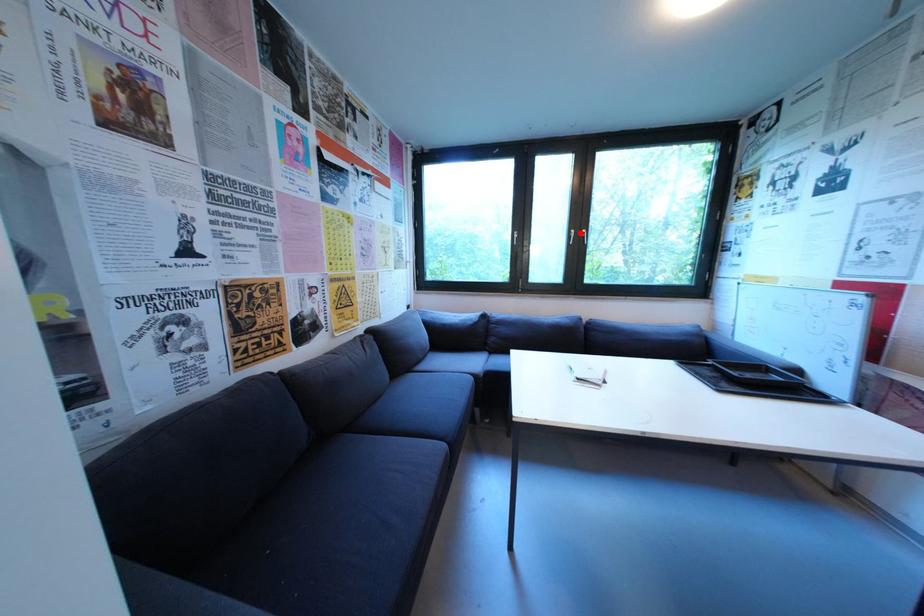
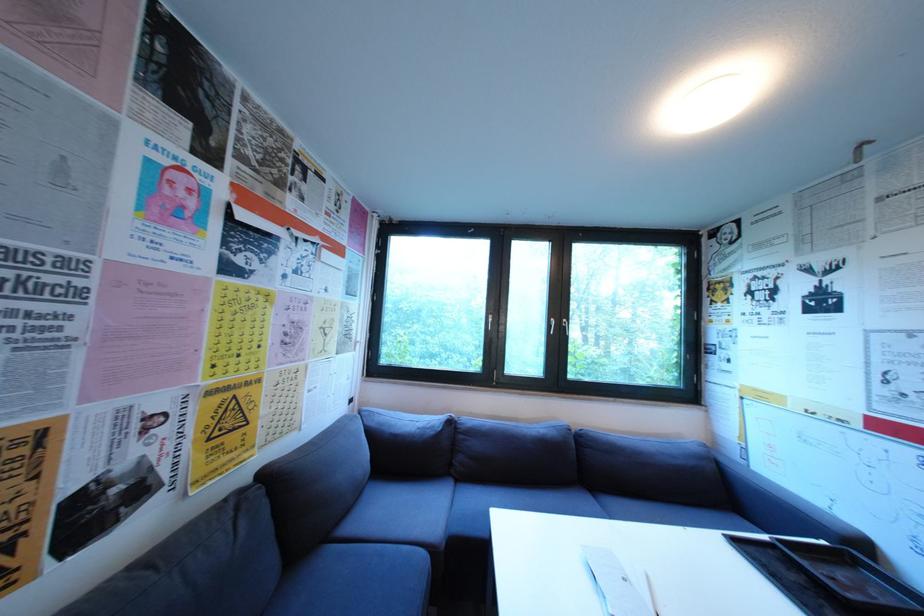
Question: I am providing you with two images of the same scene from different viewpoints. Image1 has a red point marked. In image2, the corresponding 3D location appears at what relative position? Reply with the corresponding letter.

Choices:
 (A) Closer
 (B) Farther

Answer: (B)